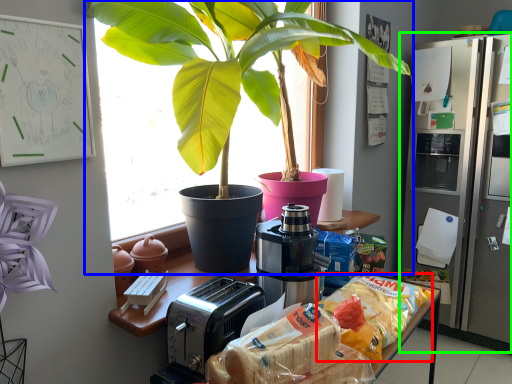
Question: Which object is the farthest from snack (highlighted by a red box)? Choose among these: houseplant (highlighted by a blue box) or fridge (highlighted by a green box).

Choices:
 (A) houseplant
 (B) fridge

Answer: (B)